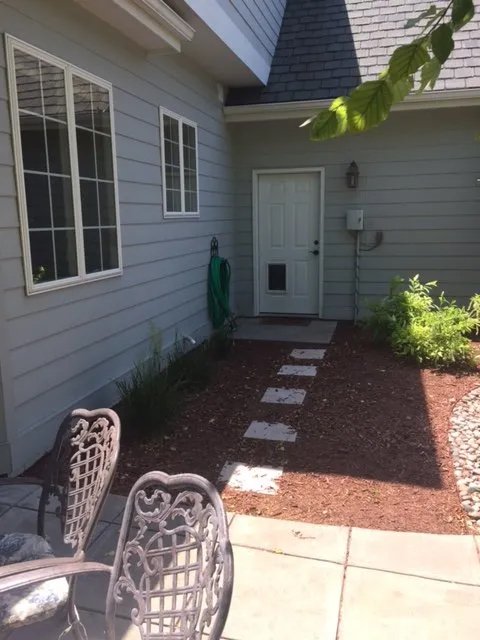
Image resolution: width=480 pixels, height=640 pixels. Identify the location of arms of the chairs. (31, 481), (35, 564), (38, 572).